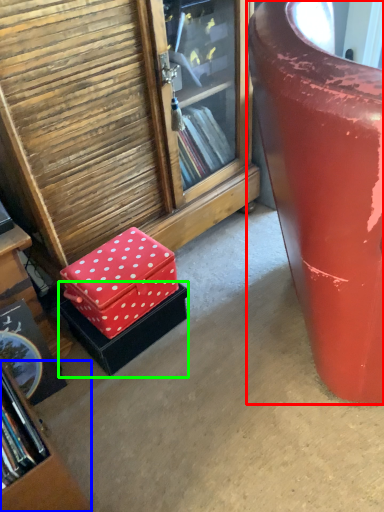
Question: Which is farther away from furniture (highlighted by a red box)? bookcase (highlighted by a blue box) or box (highlighted by a green box)?

Choices:
 (A) bookcase
 (B) box

Answer: (A)